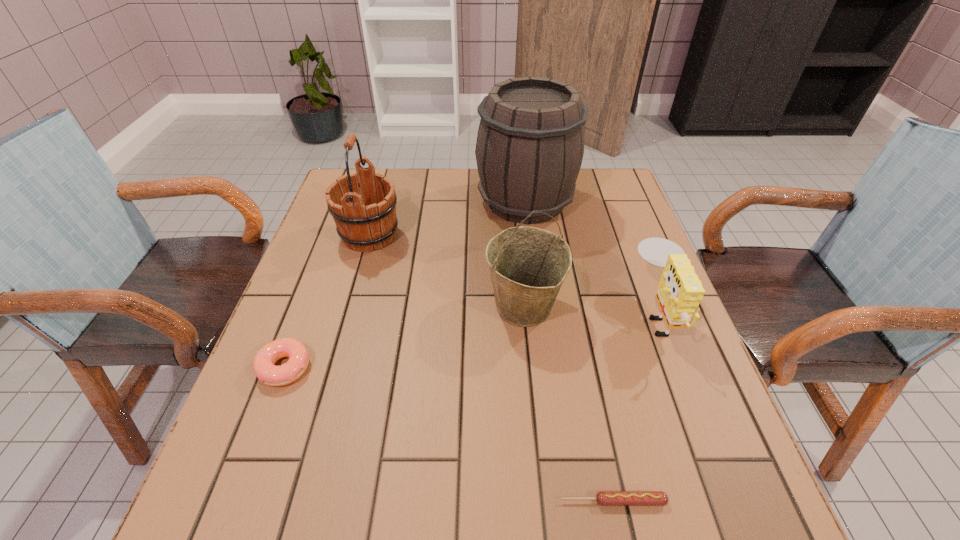
The width and height of the screenshot is (960, 540). I want to click on free spot between the second shortest object and the third shortest object, so click(x=471, y=341).

Where is `vacant space in between the doughnut and the nearest object`? vacant space in between the doughnut and the nearest object is located at coordinates (448, 434).

This screenshot has width=960, height=540. Find the location of `free spot between the nearest wine bucket and the sausage`. free spot between the nearest wine bucket and the sausage is located at coordinates (568, 403).

At what (x,y) coordinates should I click in order to perform the action: click on vacant point located between the fourth tallest object and the nearest wine bucket. Please return your answer as a coordinate pair (x, y). The image size is (960, 540). Looking at the image, I should click on (590, 310).

Identify which object is the third closest to the fourth tallest object. Please provide its 2D coordinates. Your answer should be formatted as a tuple, i.e. [(x, y)], where the tuple contains the x and y coordinates of a point satisfying the conditions above.

[(604, 498)]

Identify which object is located as the fifth nearest to the second shortest object. Please provide its 2D coordinates. Your answer should be formatted as a tuple, i.e. [(x, y)], where the tuple contains the x and y coordinates of a point satisfying the conditions above.

[(680, 291)]

Find the location of `wine bucket that is the closest one to the nearest wine bucket`. wine bucket that is the closest one to the nearest wine bucket is located at coordinates (530, 144).

Select which wine bucket is the second closest to the fourth tallest object. Please provide its 2D coordinates. Your answer should be formatted as a tuple, i.e. [(x, y)], where the tuple contains the x and y coordinates of a point satisfying the conditions above.

[(530, 144)]

This screenshot has width=960, height=540. Find the location of `blank space that satisfies the following two spatial constraints: 1. on the front-facing side of the sponge; 2. on the front side of the doughnut`. blank space that satisfies the following two spatial constraints: 1. on the front-facing side of the sponge; 2. on the front side of the doughnut is located at coordinates (679, 368).